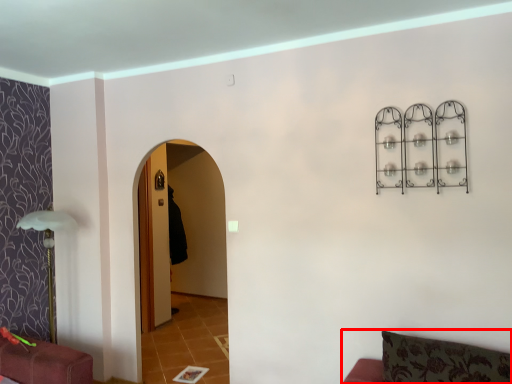
Question: Considering the relative positions of furniture (annotated by the red box) and robe in the image provided, where is furniture (annotated by the red box) located with respect to the staircase?

Choices:
 (A) right
 (B) left

Answer: (A)